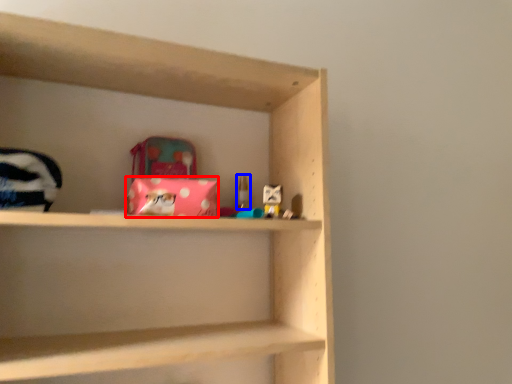
Question: Which of the following is the farthest to the observer, material (highlighted by a red box) or toy (highlighted by a blue box)?

Choices:
 (A) material
 (B) toy

Answer: (B)